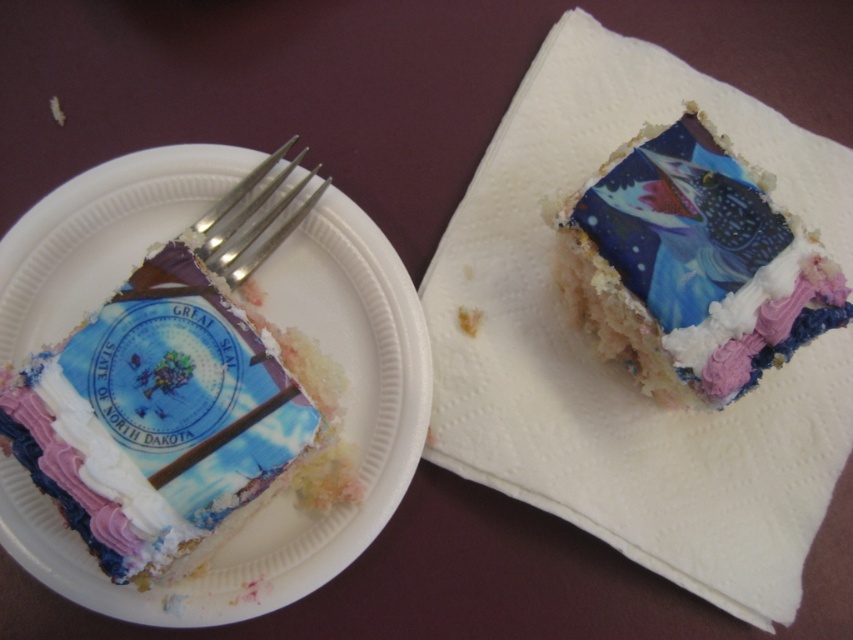
Can you confirm if matte white cake at left is shorter than silver metallic fork at upper left?

No, matte white cake at left is not shorter than silver metallic fork at upper left.

Which is in front, point (397, 444) or point (207, 257)?

Point (207, 257)

Where is `matte white cake at left`? This screenshot has height=640, width=853. matte white cake at left is located at coordinates (283, 493).

Who is lower down, silver metallic fork at upper left or purple cream frosting at upper right?

purple cream frosting at upper right is below.

Does silver metallic fork at upper left appear over purple cream frosting at upper right?

Correct, silver metallic fork at upper left is located above purple cream frosting at upper right.

Is point (294, 164) closer to camera compared to point (762, 288)?

No.

Locate an element on the screen. The image size is (853, 640). silver metallic fork at upper left is located at coordinates (254, 218).

Who is more distant from viewer, [418,317] or [688,381]?

The point [418,317] is behind.

What do you see at coordinates (283, 493) in the screenshot? The height and width of the screenshot is (640, 853). I see `matte white cake at left` at bounding box center [283, 493].

Which is behind, point (287, 602) or point (703, 278)?

Positioned behind is point (703, 278).

Find the location of a particular element. The width and height of the screenshot is (853, 640). matte white cake at left is located at coordinates (283, 493).